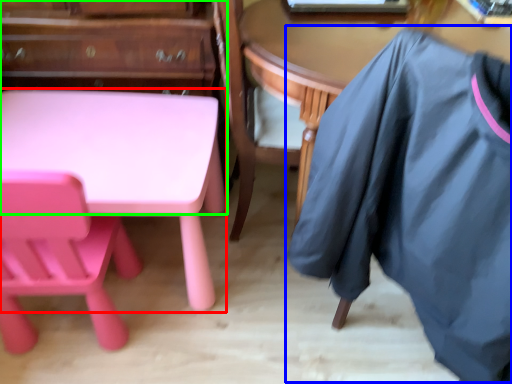
Question: Which is farther away from desk (highlighted by a red box)? clothing (highlighted by a blue box) or dresser (highlighted by a green box)?

Choices:
 (A) clothing
 (B) dresser

Answer: (A)